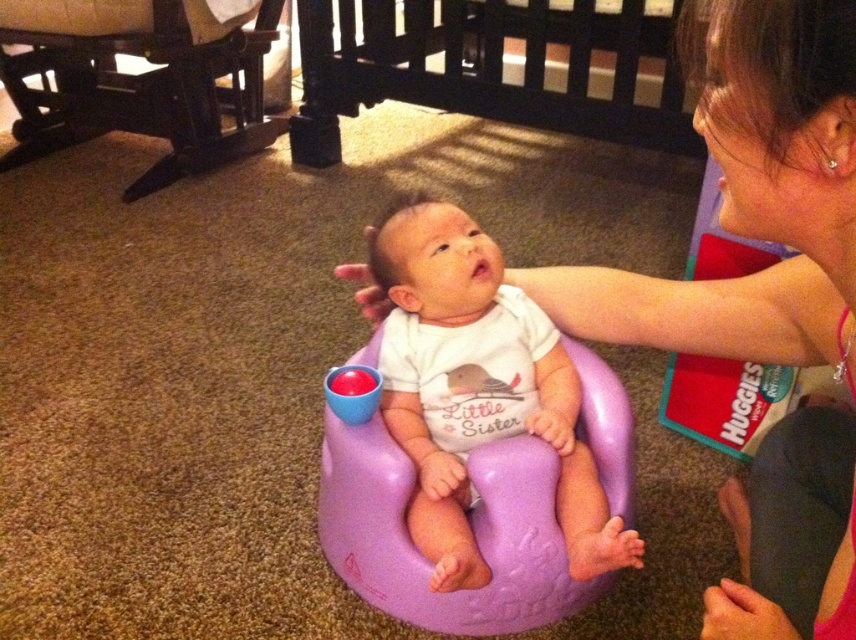
Does pink fabric at upper right appear under purple plastic baby seat at center?

No, pink fabric at upper right is not below purple plastic baby seat at center.

Which is more to the right, pink fabric at upper right or purple plastic baby seat at center?

From the viewer's perspective, pink fabric at upper right appears more on the right side.

Between point (758, 320) and point (405, 339), which one is positioned in front?

Point (758, 320)

The width and height of the screenshot is (856, 640). Identify the location of pink fabric at upper right. (750, 196).

Is point (403, 365) farther from viewer compared to point (159, 92)?

No, (403, 365) is closer to viewer.

Which is more to the left, purple plastic baby seat at center or dark wood rocking chair at lower left?

dark wood rocking chair at lower left

Is point (397, 426) less distant than point (254, 134)?

Yes, it is.

Identify the location of purple plastic baby seat at center. (477, 388).

Can you confirm if pink fabric at upper right is shorter than dark wood rocking chair at lower left?

Indeed, pink fabric at upper right has a lesser height compared to dark wood rocking chair at lower left.

Can you confirm if pink fabric at upper right is smaller than dark wood rocking chair at lower left?

Correct, pink fabric at upper right occupies less space than dark wood rocking chair at lower left.

Is point (773, 3) less distant than point (150, 88)?

Yes, it is in front of point (150, 88).

At what (x,y) coordinates should I click in order to perform the action: click on pink fabric at upper right. Please return your answer as a coordinate pair (x, y). This screenshot has width=856, height=640. Looking at the image, I should click on (750, 196).